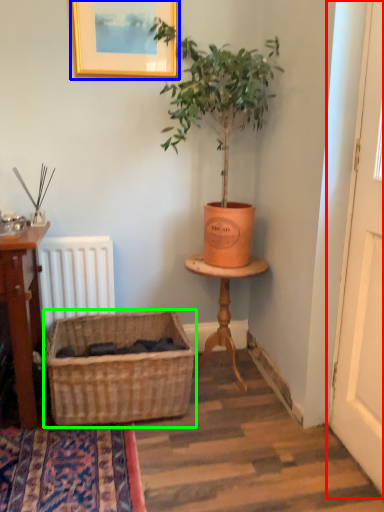
Question: Which is nearer to the screen door (highlighted by a red box)? picture frame (highlighted by a blue box) or basket (highlighted by a green box).

Choices:
 (A) picture frame
 (B) basket

Answer: (B)